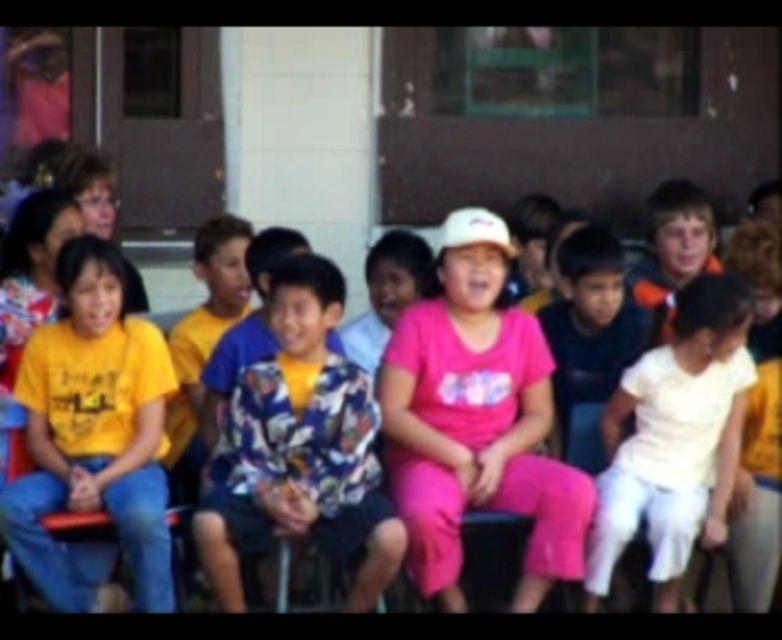
Question: Does floral-patterned shirt at center come in front of white cotton shirt at right?

Choices:
 (A) yes
 (B) no

Answer: (A)

Question: In this image, where is floral-patterned shirt at center located relative to yellow matte shirt at left?

Choices:
 (A) left
 (B) right

Answer: (B)

Question: Which of the following is the closest to the observer?

Choices:
 (A) pink matte shirt at center
 (B) floral-patterned shirt at center
 (C) white cotton shirt at right

Answer: (B)

Question: Which is farther from the yellow matte shirt at left?

Choices:
 (A) white cotton shirt at right
 (B) pink matte shirt at center
 (C) floral-patterned shirt at center

Answer: (A)

Question: Which object appears closest to the camera in this image?

Choices:
 (A) white cotton shirt at right
 (B) yellow matte shirt at left
 (C) pink matte shirt at center
 (D) floral-patterned shirt at center

Answer: (D)

Question: Can you confirm if floral-patterned shirt at center is thinner than white cotton shirt at right?

Choices:
 (A) no
 (B) yes

Answer: (A)